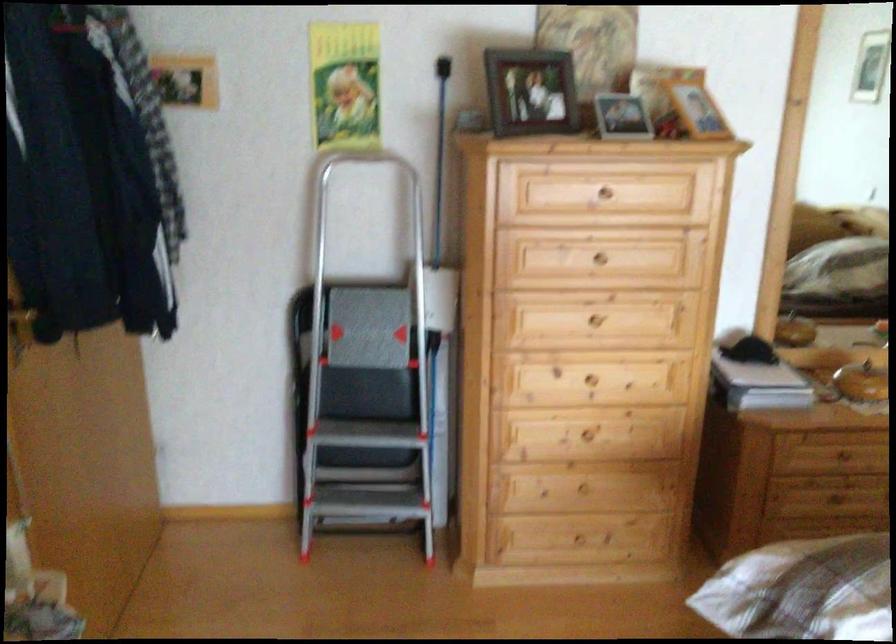
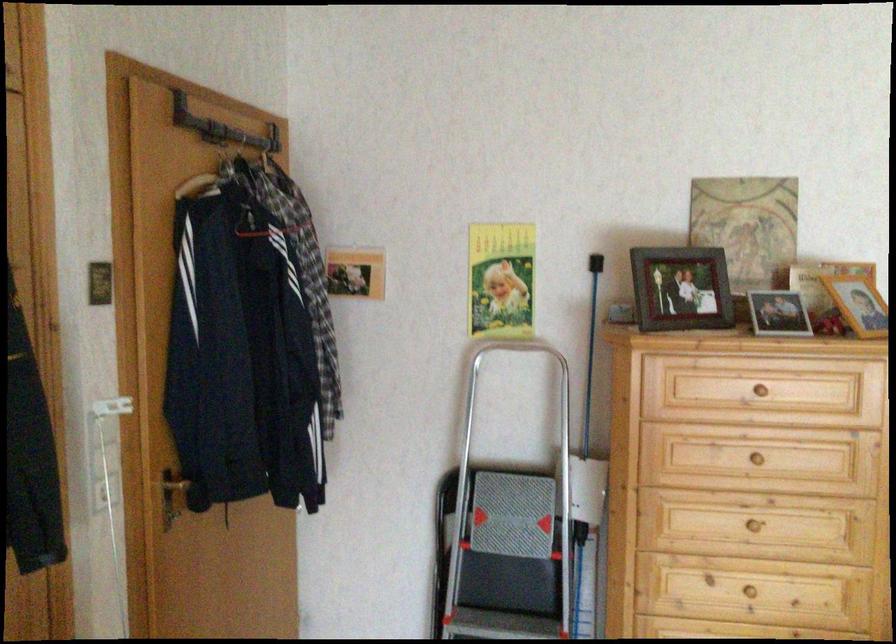
Locate, in the second image, the point that corresponds to [616,122] in the first image.

(778, 313)